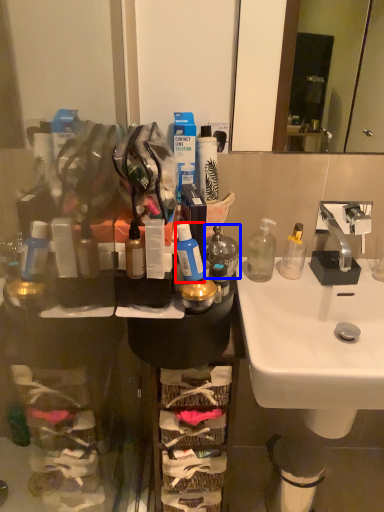
Question: Among these objects, which one is farthest to the camera, mouthwash (highlighted by a red box) or bottle (highlighted by a blue box)?

Choices:
 (A) mouthwash
 (B) bottle

Answer: (B)